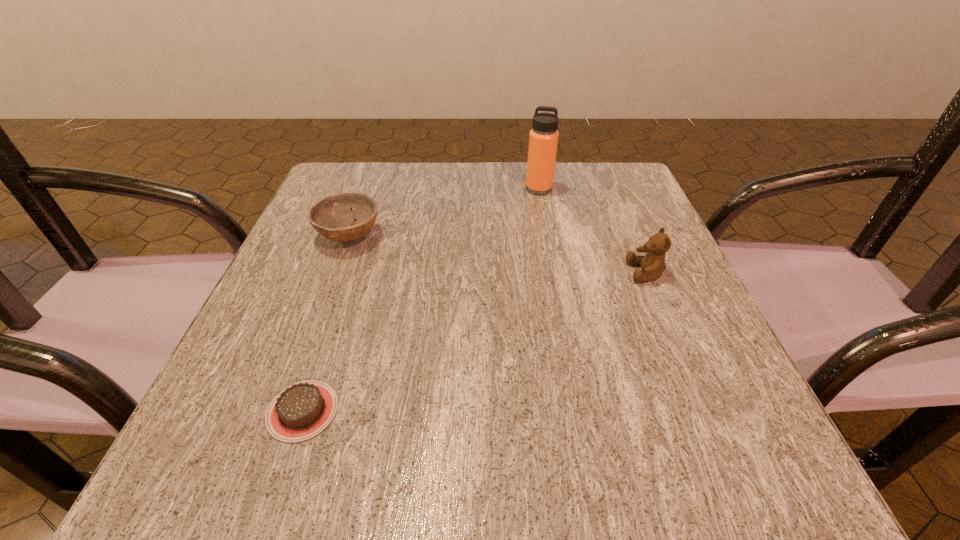
This screenshot has height=540, width=960. I want to click on the farthest object, so click(543, 139).

This screenshot has width=960, height=540. In order to click on thermos bottle in this screenshot , I will do `click(543, 139)`.

The height and width of the screenshot is (540, 960). I want to click on the second nearest object, so click(x=652, y=263).

The image size is (960, 540). Identify the location of the rightmost object. (652, 263).

This screenshot has width=960, height=540. I want to click on the second shortest object, so click(x=333, y=217).

Where is `the second farthest object`? Image resolution: width=960 pixels, height=540 pixels. the second farthest object is located at coordinates (333, 217).

I want to click on the shortest object, so click(302, 410).

Find the location of a particular element. Image resolution: width=960 pixels, height=540 pixels. chocolate cake is located at coordinates (302, 410).

Identify the location of free location located on the back of the farthest object. (535, 166).

Find the location of a particular element. free space located on the front-facing side of the third shortest object is located at coordinates (477, 273).